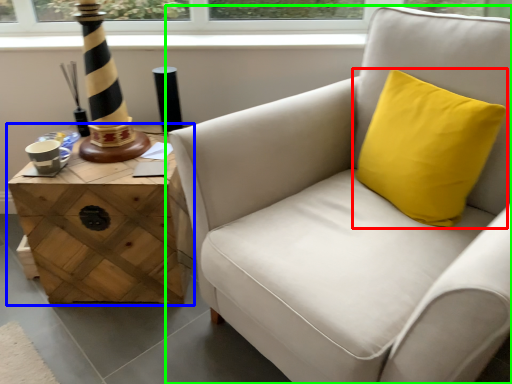
Question: Which is nearer to the pillow (highlighted by a red box)? table (highlighted by a blue box) or chair (highlighted by a green box).

Choices:
 (A) table
 (B) chair

Answer: (B)